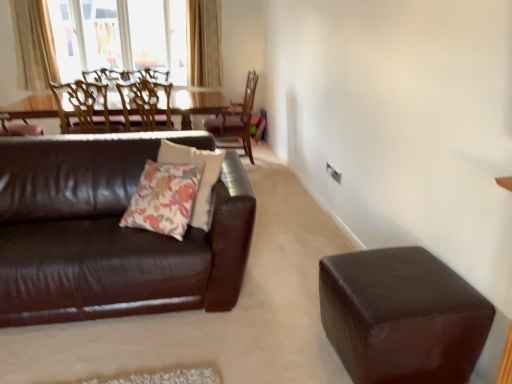
Question: Can you confirm if wooden chair at upper left, acting as the third chair starting from the right, is smaller than floral-patterned fabric pillow at center?

Choices:
 (A) yes
 (B) no

Answer: (B)

Question: Considering the relative positions of wooden chair at upper left, the 1th chair positioned from the left, and floral-patterned fabric pillow at center in the image provided, is wooden chair at upper left, the 1th chair positioned from the left, to the left of floral-patterned fabric pillow at center from the viewer's perspective?

Choices:
 (A) yes
 (B) no

Answer: (A)

Question: Considering the relative sizes of wooden chair at upper left, the 1th chair positioned from the left, and floral-patterned fabric pillow at center in the image provided, is wooden chair at upper left, the 1th chair positioned from the left, taller than floral-patterned fabric pillow at center?

Choices:
 (A) no
 (B) yes

Answer: (B)

Question: Is wooden chair at upper left, acting as the third chair starting from the right, far from floral-patterned fabric pillow at center?

Choices:
 (A) yes
 (B) no

Answer: (A)

Question: From the image's perspective, does wooden chair at upper left, acting as the third chair starting from the right, appear lower than floral-patterned fabric pillow at center?

Choices:
 (A) no
 (B) yes

Answer: (A)

Question: Is the surface of wooden chair at upper left, acting as the third chair starting from the right, in direct contact with floral-patterned fabric pillow at center?

Choices:
 (A) yes
 (B) no

Answer: (B)

Question: Is beige fabric curtain at upper left, marked as the second curtain in a right-to-left arrangement, looking in the opposite direction of shiny brown leather couch at left?

Choices:
 (A) yes
 (B) no

Answer: (B)

Question: Considering the relative sizes of beige fabric curtain at upper left, the first curtain in the left-to-right sequence, and shiny brown leather couch at left in the image provided, is beige fabric curtain at upper left, the first curtain in the left-to-right sequence, bigger than shiny brown leather couch at left?

Choices:
 (A) yes
 (B) no

Answer: (B)

Question: Can you confirm if beige fabric curtain at upper left, the first curtain in the left-to-right sequence, is thinner than shiny brown leather couch at left?

Choices:
 (A) no
 (B) yes

Answer: (B)

Question: Is beige fabric curtain at upper left, marked as the second curtain in a right-to-left arrangement, positioned in front of shiny brown leather couch at left?

Choices:
 (A) no
 (B) yes

Answer: (A)

Question: From a real-world perspective, is beige fabric curtain at upper left, the first curtain in the left-to-right sequence, located beneath shiny brown leather couch at left?

Choices:
 (A) yes
 (B) no

Answer: (B)

Question: Can you confirm if beige fabric curtain at upper left, the first curtain in the left-to-right sequence, is shorter than shiny brown leather couch at left?

Choices:
 (A) no
 (B) yes

Answer: (A)

Question: From the image's perspective, is light beige textured curtain at upper center, arranged as the second curtain when viewed from the left, below shiny brown leather couch at left?

Choices:
 (A) no
 (B) yes

Answer: (A)